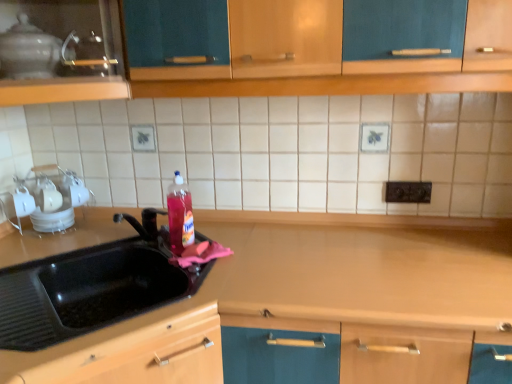
What is the approximate height of black plastic electric outlet at upper center?

It is 3.33 inches.

Where is `glass teapot at upper left, which is the 1th appliance in front-to-back order`? The width and height of the screenshot is (512, 384). glass teapot at upper left, which is the 1th appliance in front-to-back order is located at coordinates (29, 51).

From the picture: What is the approximate width of matte wood cabinet at upper left?

It is 24.33 inches.

I want to click on black plastic electric outlet at upper center, so click(x=408, y=192).

Is white glossy dish rack at left, positioned as the 2th appliance in front-to-back order, aimed at black rubber sink at left?

No, white glossy dish rack at left, positioned as the 2th appliance in front-to-back order, is not facing towards black rubber sink at left.

Is white glossy dish rack at left, the second appliance positioned from the top, outside of black rubber sink at left?

Yes, white glossy dish rack at left, the second appliance positioned from the top, is not within black rubber sink at left.

Identify the location of the 2nd appliance to the left of the black rubber sink at left, counting from the anchor's position. The width and height of the screenshot is (512, 384). (52, 220).

Is wooden counter at center positioned before matte wood cabinet at upper left?

Yes, it is.

Between wooden counter at center and matte wood cabinet at upper left, which one has larger size?

Bigger between the two is wooden counter at center.

Is wooden counter at center oriented towards matte wood cabinet at upper left?

No, wooden counter at center is not turned towards matte wood cabinet at upper left.

From the image's perspective, is wooden counter at center above or below matte wood cabinet at upper left?

Based on their image positions, wooden counter at center is located beneath matte wood cabinet at upper left.

Between black plastic electric outlet at upper center and white glossy dish rack at left, the 1th appliance from the back, which one has larger size?

white glossy dish rack at left, the 1th appliance from the back, is bigger.

Is black plastic electric outlet at upper center in front of or behind white glossy dish rack at left, the 1th appliance from the back, in the image?

Visually, black plastic electric outlet at upper center is located in front of white glossy dish rack at left, the 1th appliance from the back.

In the scene shown: From the image's perspective, would you say black plastic electric outlet at upper center is shown under white glossy dish rack at left, the 1th appliance from the back?

Actually, black plastic electric outlet at upper center appears above white glossy dish rack at left, the 1th appliance from the back, in the image.

Does black plastic electric outlet at upper center have a greater width compared to white glossy dish rack at left, positioned as the 2th appliance in front-to-back order?

Incorrect, the width of black plastic electric outlet at upper center does not surpass that of white glossy dish rack at left, positioned as the 2th appliance in front-to-back order.

Locate an element on the screen. sink below the wooden counter at center (from the image's perspective) is located at coordinates (92, 287).

Does black rubber sink at left lie behind wooden counter at center?

No, black rubber sink at left is closer to the camera.

Is black rubber sink at left completely or partially outside of wooden counter at center?

black rubber sink at left lies outside wooden counter at center's area.

Can you tell me how much black rubber sink at left and wooden counter at center differ in facing direction?

black rubber sink at left and wooden counter at center are facing 0.0618 degrees away from each other.

Considering the relative sizes of black rubber sink at left and black plastic electric outlet at upper center in the image provided, is black rubber sink at left taller than black plastic electric outlet at upper center?

Yes, black rubber sink at left is taller than black plastic electric outlet at upper center.

From a real-world perspective, which object stands above the other?

From a 3D spatial view, black plastic electric outlet at upper center is above.

What's the angular difference between black rubber sink at left and black plastic electric outlet at upper center's facing directions?

black rubber sink at left and black plastic electric outlet at upper center are facing 0.182 degrees away from each other.

Would you say black rubber sink at left contains black plastic electric outlet at upper center?

No, black plastic electric outlet at upper center is located outside of black rubber sink at left.

Does glass teapot at upper left, which is the 2th appliance in bottom-to-top order, touch white glossy dish rack at left, the second appliance positioned from the top?

No, glass teapot at upper left, which is the 2th appliance in bottom-to-top order, is not touching white glossy dish rack at left, the second appliance positioned from the top.

Identify the location of appliance below the glass teapot at upper left, which is the 2th appliance in bottom-to-top order (from a real-world perspective). This screenshot has height=384, width=512. (52, 220).

Could you tell me if glass teapot at upper left, which is the 1th appliance in front-to-back order, is facing white glossy dish rack at left, positioned as the 2th appliance in front-to-back order?

No, glass teapot at upper left, which is the 1th appliance in front-to-back order, is not oriented towards white glossy dish rack at left, positioned as the 2th appliance in front-to-back order.

Consider the image. In terms of size, does glass teapot at upper left, the first appliance in the top-to-bottom sequence, appear bigger or smaller than white glossy dish rack at left, the 1th appliance from the back?

Considering their sizes, glass teapot at upper left, the first appliance in the top-to-bottom sequence, takes up more space than white glossy dish rack at left, the 1th appliance from the back.

From the picture: Can you confirm if matte wood cabinet at upper left is shorter than glass teapot at upper left, which is the 2th appliance in bottom-to-top order?

Incorrect, the height of matte wood cabinet at upper left does not fall short of that of glass teapot at upper left, which is the 2th appliance in bottom-to-top order.

From a real-world perspective, which object stands above the other?

From a 3D spatial view, glass teapot at upper left, the first appliance in the top-to-bottom sequence, is above.

Is matte wood cabinet at upper left far from glass teapot at upper left, the first appliance in the top-to-bottom sequence?

No, matte wood cabinet at upper left is not far away from glass teapot at upper left, the first appliance in the top-to-bottom sequence.

From the image's perspective, which one is positioned higher, matte wood cabinet at upper left or glass teapot at upper left, the first appliance in the top-to-bottom sequence?

From the image's view, glass teapot at upper left, the first appliance in the top-to-bottom sequence, is above.

You are a GUI agent. You are given a task and a screenshot of the screen. Output one action in this format:
    pyautogui.click(x=<x>, y=<y>)
    Task: Click on the 1st appliance located above the black rubber sink at left (from a real-world perspective)
    
    Given the screenshot: What is the action you would take?
    pyautogui.click(x=52, y=220)

This screenshot has height=384, width=512. In the image, there is a matte wood cabinet at upper left. In order to click on counter top below it (from a real-world perspective) in this screenshot , I will do `click(362, 267)`.

Based on their spatial positions, is glass teapot at upper left, which ranks as the 2th appliance in back-to-front order, or wooden counter at center closer to white glossy dish rack at left, the first appliance from the bottom?

glass teapot at upper left, which ranks as the 2th appliance in back-to-front order, is positioned closer to the anchor white glossy dish rack at left, the first appliance from the bottom.

Which object lies further to the anchor point white glossy dish rack at left, the first appliance from the bottom, black rubber sink at left or glass teapot at upper left, which ranks as the 2th appliance in back-to-front order?

glass teapot at upper left, which ranks as the 2th appliance in back-to-front order, is positioned further to the anchor white glossy dish rack at left, the first appliance from the bottom.

When comparing their distances from black rubber sink at left, does translucent plastic bottle at sink or wooden counter at center seem closer?

translucent plastic bottle at sink.

Based on their spatial positions, is wooden counter at center or black plastic electric outlet at upper center closer to glass teapot at upper left, which ranks as the 2th appliance in back-to-front order?

Among the two, wooden counter at center is located nearer to glass teapot at upper left, which ranks as the 2th appliance in back-to-front order.

When comparing their distances from wooden counter at center, does matte wood cabinet at upper left or black rubber sink at left seem further?

Among the two, matte wood cabinet at upper left is located further to wooden counter at center.

From the image, which object appears to be farther from translucent plastic bottle at sink, matte wood cabinet at upper left or black plastic electric outlet at upper center?

Among the two, black plastic electric outlet at upper center is located further to translucent plastic bottle at sink.

Looking at the image, which one is located further to white glossy dish rack at left, the second appliance positioned from the top, matte wood cabinet at upper left or black rubber sink at left?

Among the two, matte wood cabinet at upper left is located further to white glossy dish rack at left, the second appliance positioned from the top.

Based on their spatial positions, is white glossy dish rack at left, the 1th appliance from the back, or black plastic electric outlet at upper center further from matte wood cabinet at upper left?

Based on the image, black plastic electric outlet at upper center appears to be further to matte wood cabinet at upper left.

At what (x,y) coordinates should I click in order to perform the action: click on bottle between black rubber sink at left and black plastic electric outlet at upper center from left to right. Please return your answer as a coordinate pair (x, y). The height and width of the screenshot is (384, 512). Looking at the image, I should click on (180, 215).

Find the location of a particular element. Image resolution: width=512 pixels, height=384 pixels. bottle located between black rubber sink at left and white glossy dish rack at left, positioned as the 2th appliance in front-to-back order, in the depth direction is located at coordinates (180, 215).

Locate an element on the screen. appliance between glass teapot at upper left, which ranks as the 2th appliance in back-to-front order, and black rubber sink at left vertically is located at coordinates (52, 220).

At what (x,y) coordinates should I click in order to perform the action: click on bottle between glass teapot at upper left, the first appliance in the top-to-bottom sequence, and black plastic electric outlet at upper center, in the horizontal direction. Please return your answer as a coordinate pair (x, y). This screenshot has height=384, width=512. Looking at the image, I should click on (180, 215).